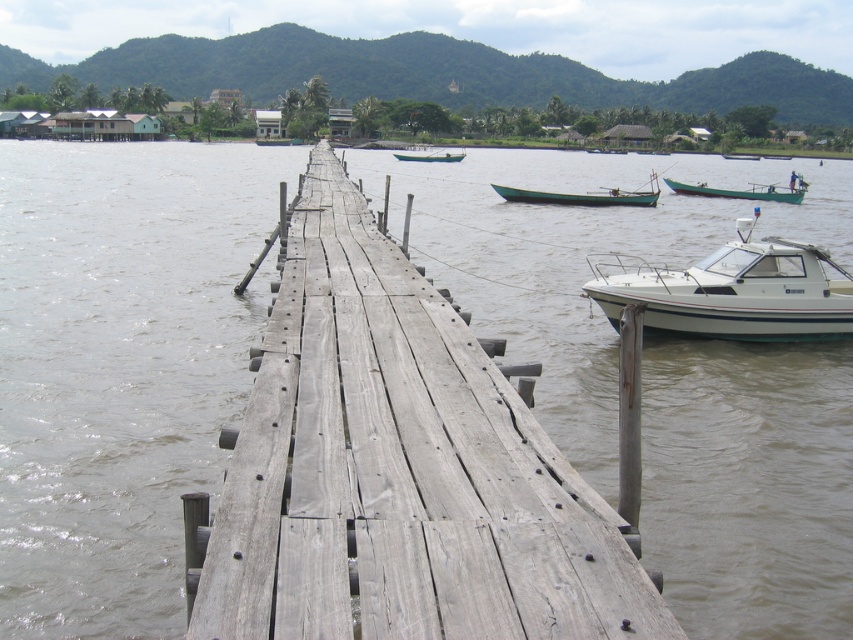
You are an observer standing on the weathered wooden pier. You see the white glossy boat at right and the green matte boat at center. Which boat takes up more space in the scene?

The green matte boat at center takes up more space in the scene than the white glossy boat at right because the white glossy boat at right occupies less space than the green matte boat at center.

Based on the coordinates provided in the scene description, where is the green wooden boat at center located?

The green wooden boat at center is located at point (583, 195).

You are standing at the wooden pier and want to walk towards a specific location. You see two points marked in the image. Which of the two points, point [231,634] or point [792,193], is closer to you as you stand on the pier?

Point [231,634] is closer to you because it is in front of point [792,193] from your perspective on the pier.